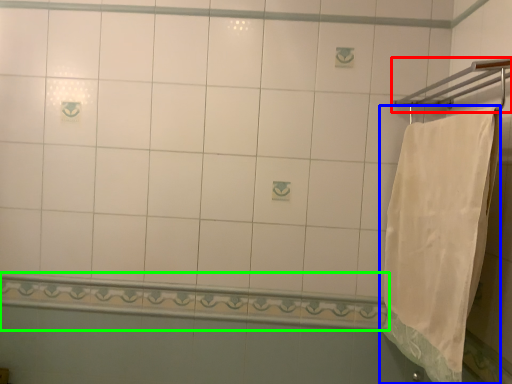
Question: Which object is the closest to the towel bar (highlighted by a red box)? Choose among these: towel (highlighted by a blue box) or balustrade (highlighted by a green box).

Choices:
 (A) towel
 (B) balustrade

Answer: (A)